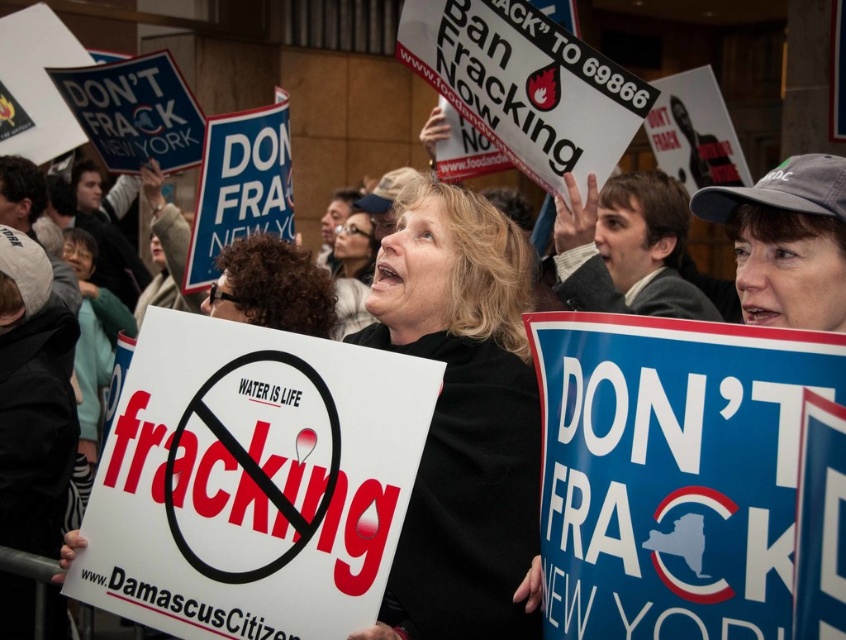
In the scene shown: You are a photographer trying to capture the central protest sign. Given that your camera has a focal point at coordinates 0.7, 0.8, will the blue paper sign at center be in focus?

The blue paper sign at center is located at coordinates (673, 472), which is very close to the camera focal point at (676, 448). Therefore, the blue paper sign at center will be in focus.